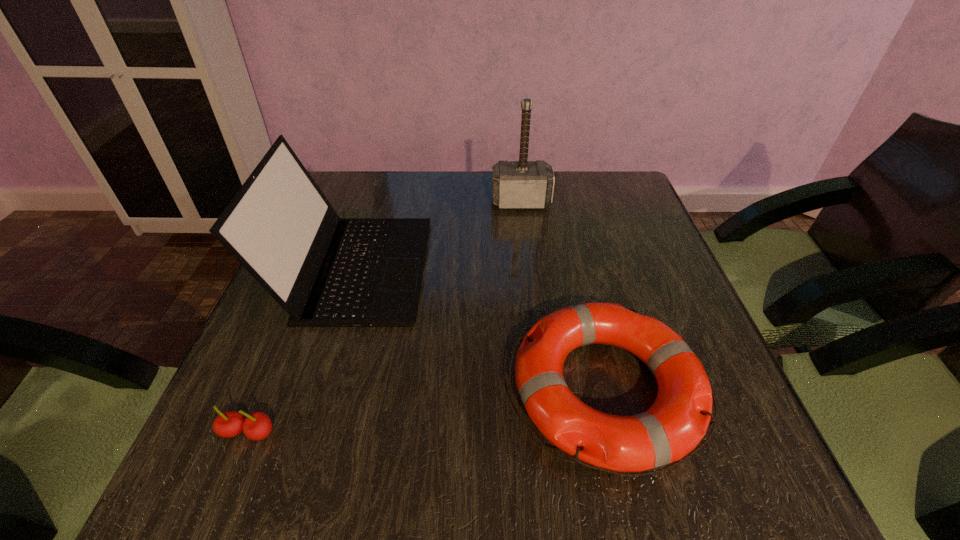
Locate an element on the screen. This screenshot has height=540, width=960. vacant space at the far right corner of the desktop is located at coordinates coord(627,191).

Find the location of `free space at the near right corner of the desktop`. free space at the near right corner of the desktop is located at coordinates (675, 496).

The height and width of the screenshot is (540, 960). Find the location of `vacant area that lies between the laptop and the hammer`. vacant area that lies between the laptop and the hammer is located at coordinates (438, 235).

This screenshot has width=960, height=540. In order to click on free space between the life buoy and the cherry in this screenshot , I will do (x=426, y=411).

The image size is (960, 540). Find the location of `vacant point located between the life buoy and the hammer`. vacant point located between the life buoy and the hammer is located at coordinates (564, 296).

Locate an element on the screen. This screenshot has height=540, width=960. free spot between the life buoy and the farthest object is located at coordinates (564, 296).

Identify the location of free space between the farthest object and the third shortest object. The height and width of the screenshot is (540, 960). (438, 235).

Where is `empty space between the laptop and the cherry`? empty space between the laptop and the cherry is located at coordinates (301, 350).

The width and height of the screenshot is (960, 540). Identify the location of free point between the cherry and the life buoy. (426, 411).

You are a GUI agent. You are given a task and a screenshot of the screen. Output one action in this format:
    pyautogui.click(x=<x>, y=<y>)
    Task: Click on the empty space that is in between the life buoy and the cherry
    
    Given the screenshot: What is the action you would take?
    pyautogui.click(x=426, y=411)